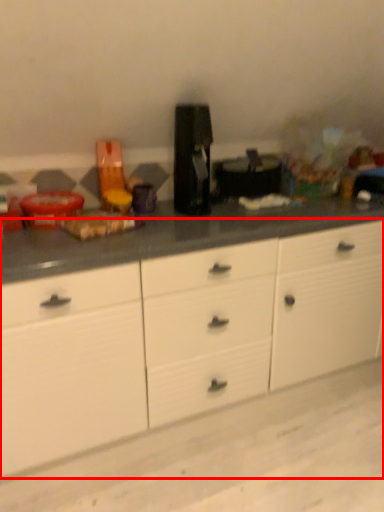
Question: From the image's perspective, considering the relative positions of cabinetry (annotated by the red box) and coffee machine in the image provided, where is cabinetry (annotated by the red box) located with respect to the staircase?

Choices:
 (A) below
 (B) above

Answer: (A)